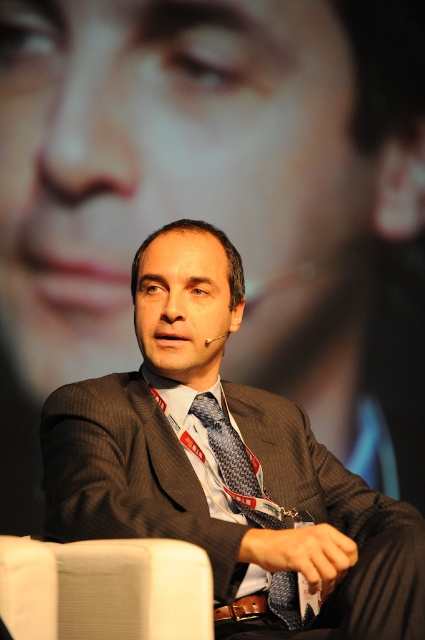
Question: Can you confirm if matte gray suit at center is smaller than white fabric chair at lower left?

Choices:
 (A) yes
 (B) no

Answer: (B)

Question: Which object appears closest to the camera in this image?

Choices:
 (A) white fabric chair at lower left
 (B) matte gray suit at center

Answer: (A)

Question: In this image, where is white fabric chair at lower left located relative to patterned silk tie at center?

Choices:
 (A) below
 (B) above

Answer: (A)

Question: Which point is farther from the camera taking this photo?

Choices:
 (A) (190, 253)
 (B) (115, 593)

Answer: (A)

Question: Which point appears farthest from the camera in this image?

Choices:
 (A) (198, 516)
 (B) (212, 397)
 (C) (17, 545)

Answer: (B)

Question: Can you confirm if white fabric chair at lower left is smaller than patterned silk tie at center?

Choices:
 (A) yes
 (B) no

Answer: (A)